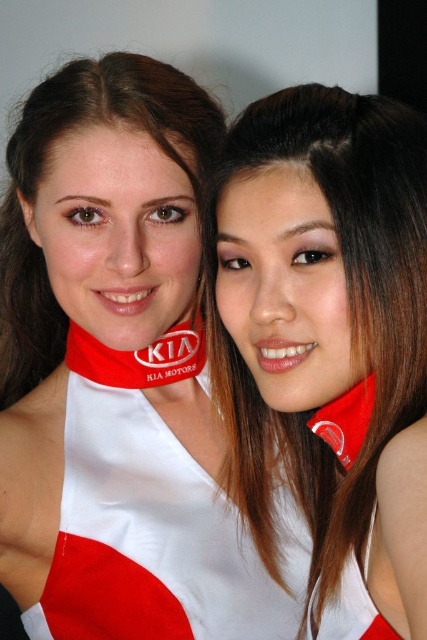
Question: Does white matte necktie at center come behind red fabric at center?

Choices:
 (A) yes
 (B) no

Answer: (B)

Question: Which point appears closest to the camera in this image?

Choices:
 (A) (353, 376)
 (B) (152, 346)

Answer: (A)

Question: Can you confirm if white matte necktie at center is wider than red fabric at center?

Choices:
 (A) no
 (B) yes

Answer: (B)

Question: Which point is closer to the camera?

Choices:
 (A) (125, 364)
 (B) (289, 454)

Answer: (A)

Question: Considering the relative positions of white matte necktie at center and red fabric at center in the image provided, where is white matte necktie at center located with respect to red fabric at center?

Choices:
 (A) above
 (B) below

Answer: (B)